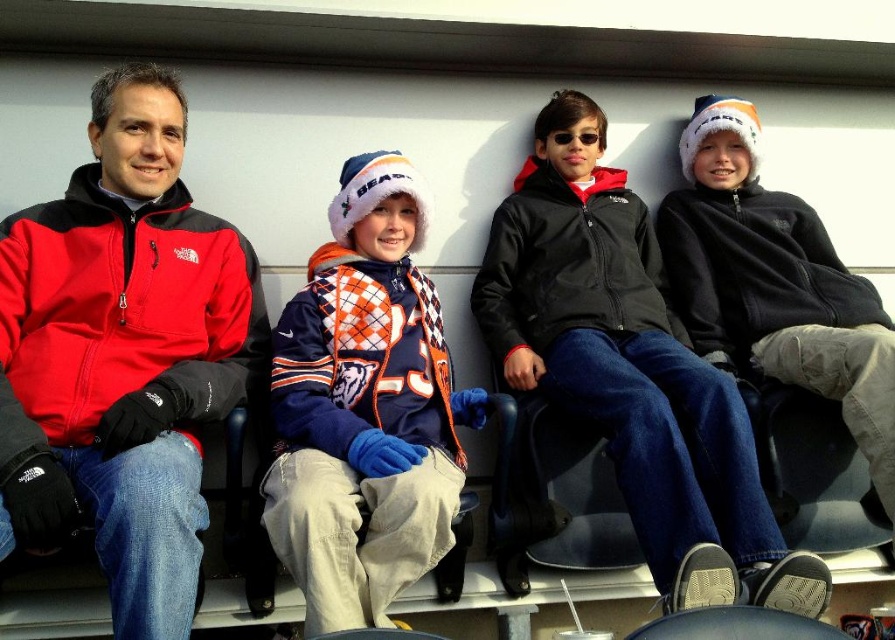
Is matte black jacket at left positioned before black fleece jacket at center?

That is True.

Is matte black jacket at left above black fleece jacket at center?

Correct, matte black jacket at left is located above black fleece jacket at center.

Is point (107, 403) less distant than point (570, 273)?

Yes, point (107, 403) is in front of point (570, 273).

At what (x,y) coordinates should I click in order to perform the action: click on matte black jacket at left. Please return your answer as a coordinate pair (x, y). The height and width of the screenshot is (640, 895). Looking at the image, I should click on (122, 355).

Is matte black jacket at left bigger than orange and white argyle sweater at center?

Correct, matte black jacket at left is larger in size than orange and white argyle sweater at center.

Is matte black jacket at left closer to camera compared to orange and white argyle sweater at center?

Yes.

At what (x,y) coordinates should I click in order to perform the action: click on matte black jacket at left. Please return your answer as a coordinate pair (x, y). This screenshot has width=895, height=640. Looking at the image, I should click on (122, 355).

The image size is (895, 640). Identify the location of matte black jacket at left. (122, 355).

Based on the photo, how much distance is there between matte black jacket at left and black fleece jacket at right?

1.96 meters

Is matte black jacket at left to the right of black fleece jacket at right from the viewer's perspective?

No, matte black jacket at left is not to the right of black fleece jacket at right.

Find the location of a particular element. matte black jacket at left is located at coordinates (122, 355).